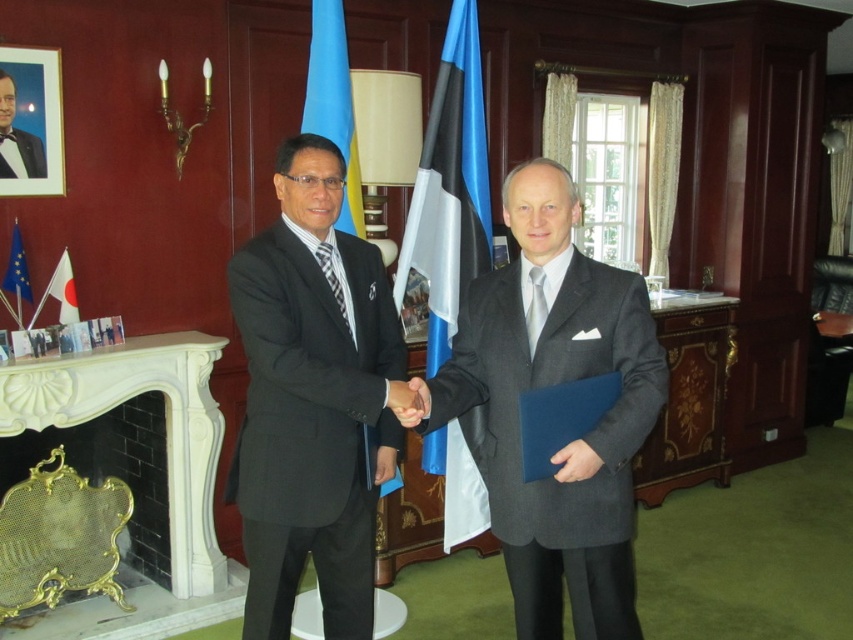
Question: Can you confirm if blue/white fabric flag at center is positioned below matte blue folder at center?

Choices:
 (A) yes
 (B) no

Answer: (B)

Question: Considering the relative positions of matte black suit at center and gray wool suit at center in the image provided, where is matte black suit at center located with respect to gray wool suit at center?

Choices:
 (A) above
 (B) below

Answer: (B)

Question: Which point is farther from the camera taking this photo?

Choices:
 (A) (345, 164)
 (B) (585, 460)
 (C) (24, 150)

Answer: (C)

Question: Which object is positioned farthest from the blue fabric flag at center?

Choices:
 (A) smooth skin handshake at center
 (B) gray wool suit at center

Answer: (A)

Question: Which object is farther from the camera taking this photo?

Choices:
 (A) matte blue folder at center
 (B) gray wool suit at center
 (C) matte black suit at center

Answer: (C)

Question: Can you confirm if smooth skin handshake at center is bigger than white fabric flag at left?

Choices:
 (A) no
 (B) yes

Answer: (A)